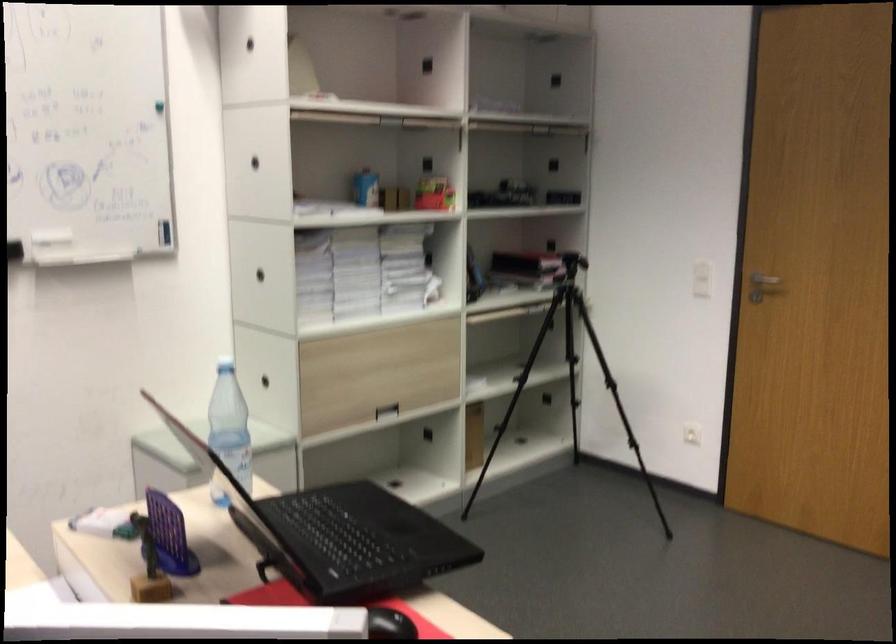
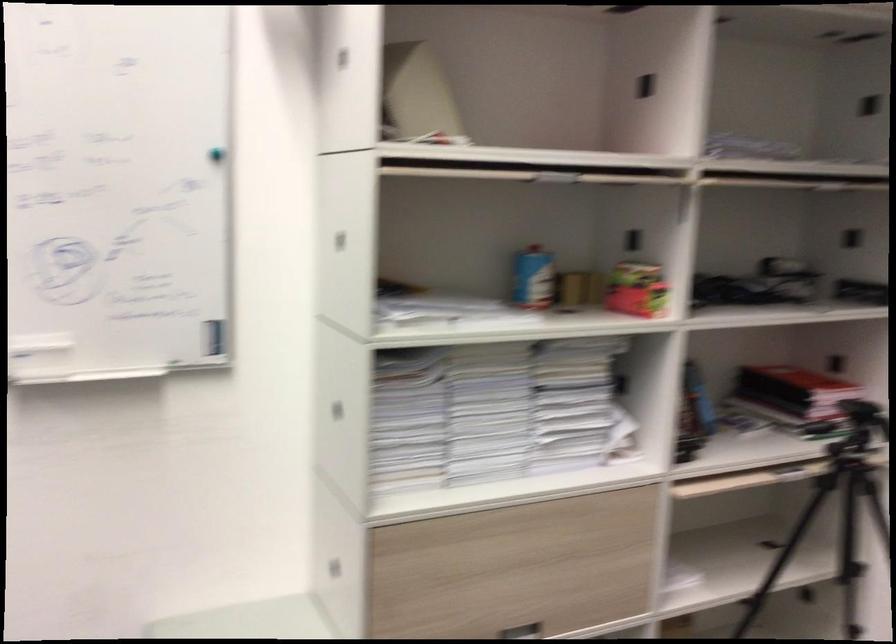
Locate, in the second image, the point that corresponds to (533,265) in the first image.

(793, 398)